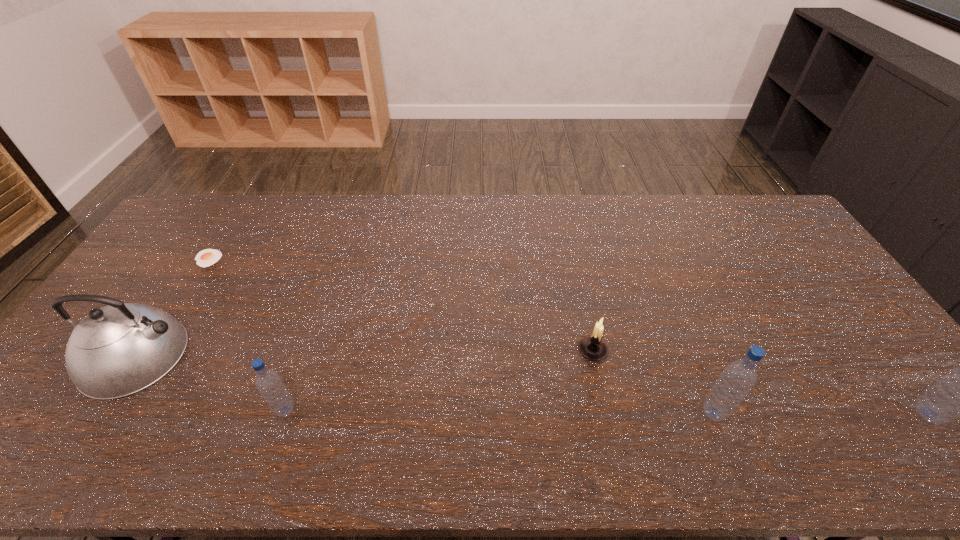
The image size is (960, 540). I want to click on the leftmost water bottle, so click(268, 382).

I want to click on the fourth tallest object, so click(x=268, y=382).

The height and width of the screenshot is (540, 960). I want to click on the second shortest water bottle, so click(x=737, y=379).

Locate an element on the screen. This screenshot has height=540, width=960. the second water bottle from right to left is located at coordinates (737, 379).

The width and height of the screenshot is (960, 540). In order to click on the rightmost object in this screenshot , I will do `click(959, 394)`.

The width and height of the screenshot is (960, 540). I want to click on the rightmost water bottle, so click(x=959, y=394).

Locate an element on the screen. the farthest object is located at coordinates (207, 257).

Find the location of a particular element. The image size is (960, 540). the shortest object is located at coordinates (207, 257).

I want to click on kettle, so click(117, 350).

The width and height of the screenshot is (960, 540). I want to click on candle holder, so click(x=593, y=347).